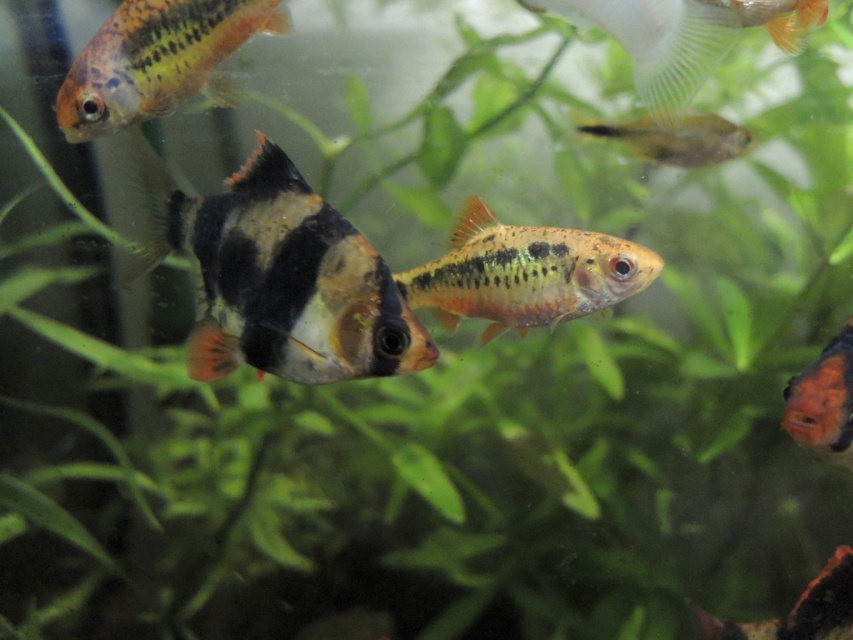
You are a diver in the aquarium and want to reach the point marked at coordinates [233,42]. If your maximum reach is 1.5 meters, can you touch that point?

The point at coordinates [233,42] is 1.63 meters away from the camera, which is beyond your maximum reach of 1.5 meters. You cannot touch it.

You are an underwater explorer who wants to reach the translucent plastic fin at upper right. From your current position near the black and orange fish at center, which direction should you swim to get there?

You should swim to the right because the translucent plastic fin at upper right is to the right of the black and orange fish at center.

You are a diver in the aquarium and see two points marked in the scene. The first point is at coordinates point (132, 38) and the second point is at point (718, 144). Which point is closer to you?

Point (132, 38) is in front of point (718, 144), so it is closer to you.